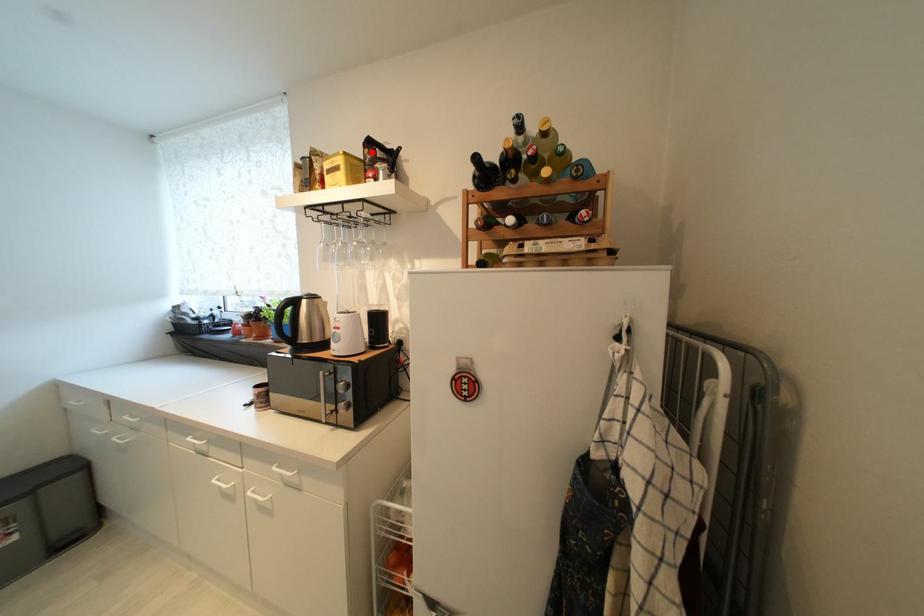
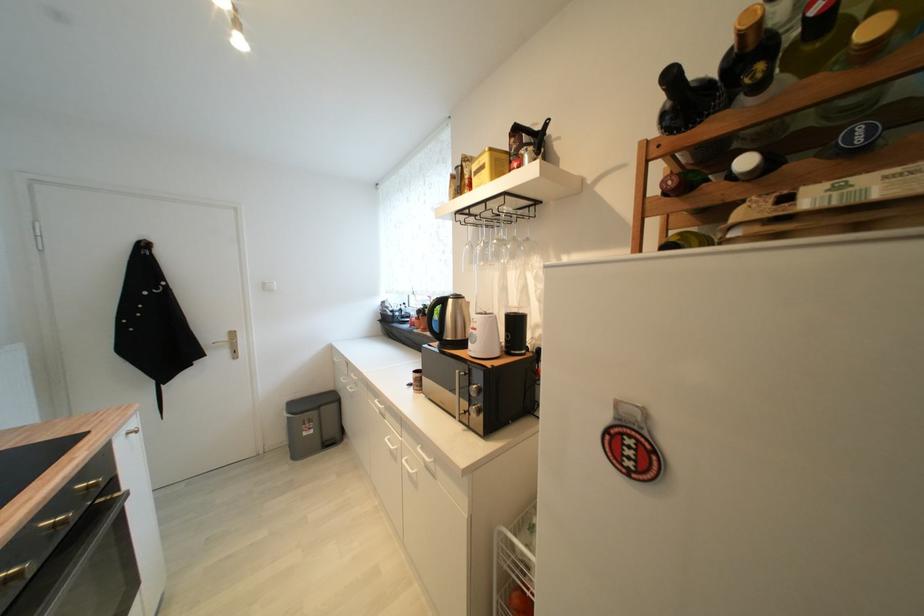
Locate, in the second image, the point that corresponds to the highlighted location in the first image.

(517, 142)